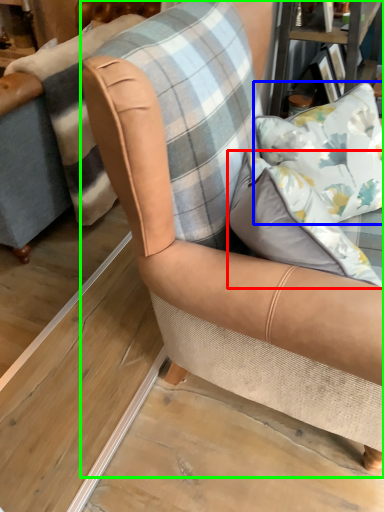
Question: Based on their relative distances, which object is farther from pillow (highlighted by a red box)? Choose from pillow (highlighted by a blue box) and chair (highlighted by a green box).

Choices:
 (A) pillow
 (B) chair

Answer: (A)